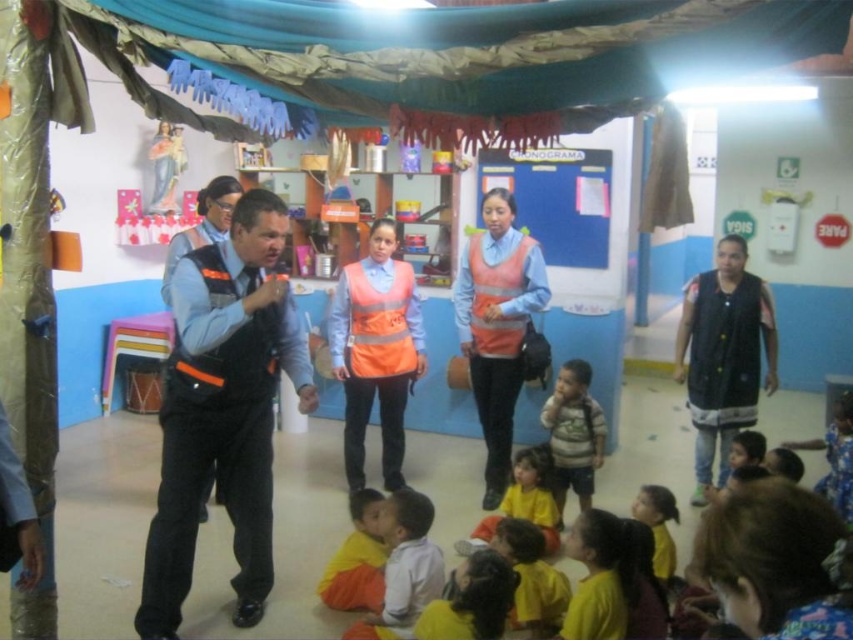
Question: Is white cotton shirt at lower center further to the viewer compared to yellow matte shirt at lower center?

Choices:
 (A) yes
 (B) no

Answer: (B)

Question: Estimate the real-world distances between objects in this image. Which object is closer to the orange reflective safety vest at center?

Choices:
 (A) white cotton shirt at lower center
 (B) reflective orange vest at center

Answer: (A)

Question: Which of the following is the farthest from the observer?

Choices:
 (A) reflective orange vest at center
 (B) neon orange reflective safety vest at center
 (C) yellow fabric at lower center

Answer: (B)

Question: Which object is closer to the camera taking this photo?

Choices:
 (A) yellow fabric at lower center
 (B) yellow matte shirt at lower center

Answer: (A)

Question: Is black fabric vest at right further to camera compared to orange reflective safety vest at center?

Choices:
 (A) no
 (B) yes

Answer: (A)

Question: Does orange fabric vest at center have a greater width compared to white cotton shirt at lower center?

Choices:
 (A) yes
 (B) no

Answer: (A)